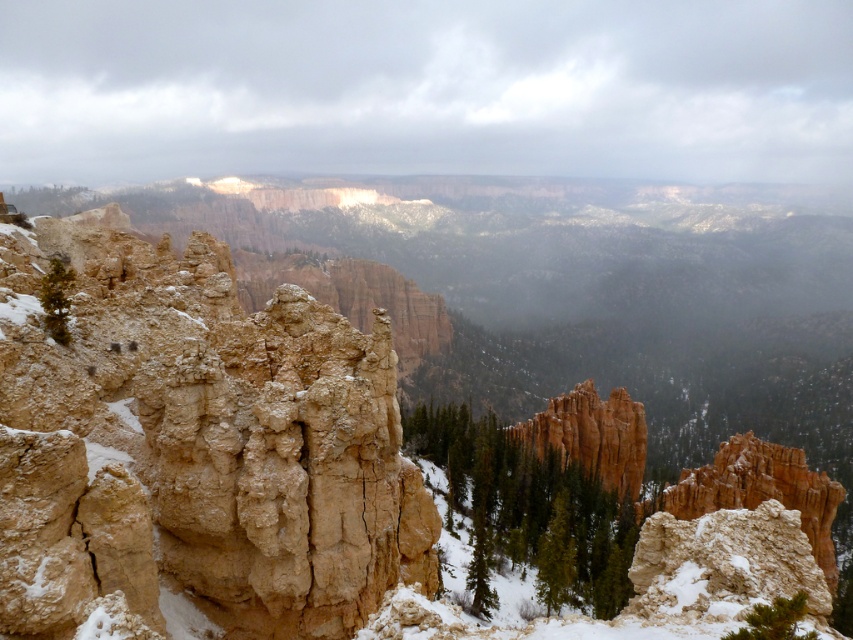
You are a hiker planning to take a photo of the rugged sandstone canyon at center and the beige rough rock at left. From your current position, which object will appear closer to you in the photo?

The rugged sandstone canyon at center will appear closer to you in the photo because the beige rough rock at left is positioned behind it.

You are a hiker standing at the beige rough rock at left and want to reach the rugged sandstone canyon at center. Which direction should you move to get there?

The rugged sandstone canyon at center is to the left of the beige rough rock at left, so you should move to the right to reach it.

What does the point marked at coordinates (206, 432) on the image represent?

The point marked at coordinates (206, 432) represents the rugged sandstone canyon at center.